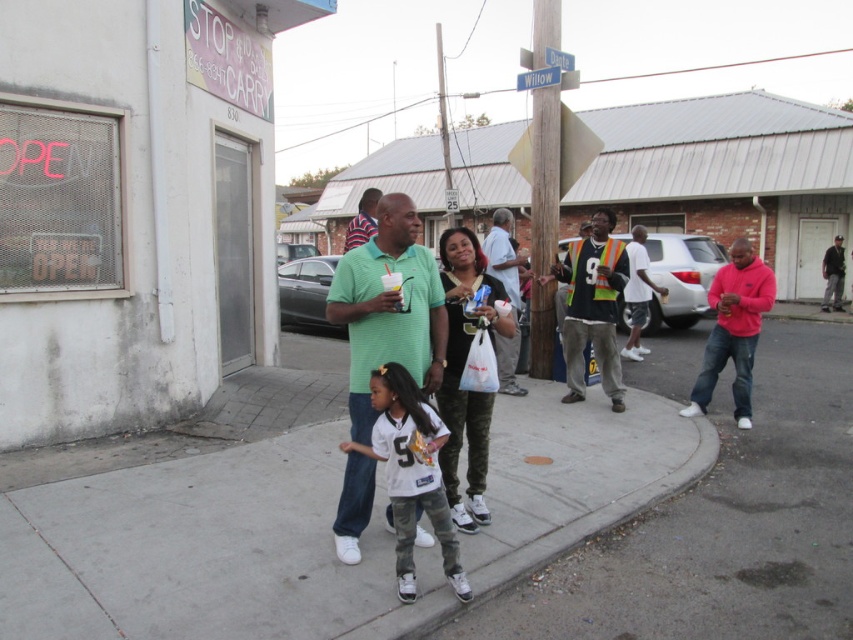
Question: Which point is closer to the camera?

Choices:
 (A) matte green shirt at center
 (B) green textured polo shirt at center
 (C) gray concrete sidewalk at center

Answer: (C)

Question: Can you confirm if pink fleece at right is positioned to the right of dark gray jeans at center?

Choices:
 (A) yes
 (B) no

Answer: (B)

Question: Is white cotton shirt at center smaller than dark gray jeans at center?

Choices:
 (A) no
 (B) yes

Answer: (A)

Question: Is pink fleece at right above striped shirt at center?

Choices:
 (A) yes
 (B) no

Answer: (B)

Question: Among these objects, which one is nearest to the camera?

Choices:
 (A) pink fleece at right
 (B) camo pants at center
 (C) striped shirt at center
 (D) gray concrete sidewalk at center

Answer: (D)

Question: Which of these objects is positioned closest to the matte green shirt at center?

Choices:
 (A) white jersey at center
 (B) dark gray jeans at center

Answer: (A)